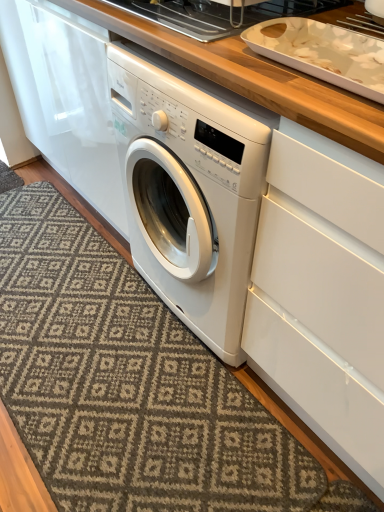
Question: Is white glossy tray at upper right thinner than white glossy tray at upper center?

Choices:
 (A) yes
 (B) no

Answer: (A)

Question: Is white glossy tray at upper right aimed at white glossy tray at upper center?

Choices:
 (A) yes
 (B) no

Answer: (B)

Question: Does white glossy tray at upper right appear on the left side of white glossy tray at upper center?

Choices:
 (A) yes
 (B) no

Answer: (B)

Question: Does white glossy tray at upper right have a greater height compared to white glossy tray at upper center?

Choices:
 (A) no
 (B) yes

Answer: (A)

Question: From a real-world perspective, is white glossy tray at upper right positioned over white glossy tray at upper center based on gravity?

Choices:
 (A) no
 (B) yes

Answer: (B)

Question: Considering their positions, is white glossy tray at upper center located in front of or behind white glossy tray at upper right?

Choices:
 (A) behind
 (B) front

Answer: (A)

Question: Is white glossy tray at upper center taller or shorter than white glossy tray at upper right?

Choices:
 (A) tall
 (B) short

Answer: (A)

Question: Is white glossy tray at upper center inside the boundaries of white glossy tray at upper right, or outside?

Choices:
 (A) inside
 (B) outside

Answer: (B)

Question: Does point (203, 31) appear closer or farther from the camera than point (264, 34)?

Choices:
 (A) closer
 (B) farther

Answer: (B)

Question: From a real-world perspective, is patterned carpet at lower left above or below white glossy tray at upper right?

Choices:
 (A) above
 (B) below

Answer: (B)

Question: In terms of width, does patterned carpet at lower left look wider or thinner when compared to white glossy tray at upper right?

Choices:
 (A) thin
 (B) wide

Answer: (B)

Question: Is patterned carpet at lower left spatially inside white glossy tray at upper right, or outside of it?

Choices:
 (A) outside
 (B) inside

Answer: (A)

Question: Considering the relative positions of patterned carpet at lower left and white glossy tray at upper right in the image provided, is patterned carpet at lower left to the left or to the right of white glossy tray at upper right?

Choices:
 (A) left
 (B) right

Answer: (A)

Question: Choose the correct answer: Is white glossy tray at upper center inside patterned carpet at lower left or outside it?

Choices:
 (A) inside
 (B) outside

Answer: (B)

Question: In terms of size, does white glossy tray at upper center appear bigger or smaller than patterned carpet at lower left?

Choices:
 (A) big
 (B) small

Answer: (B)